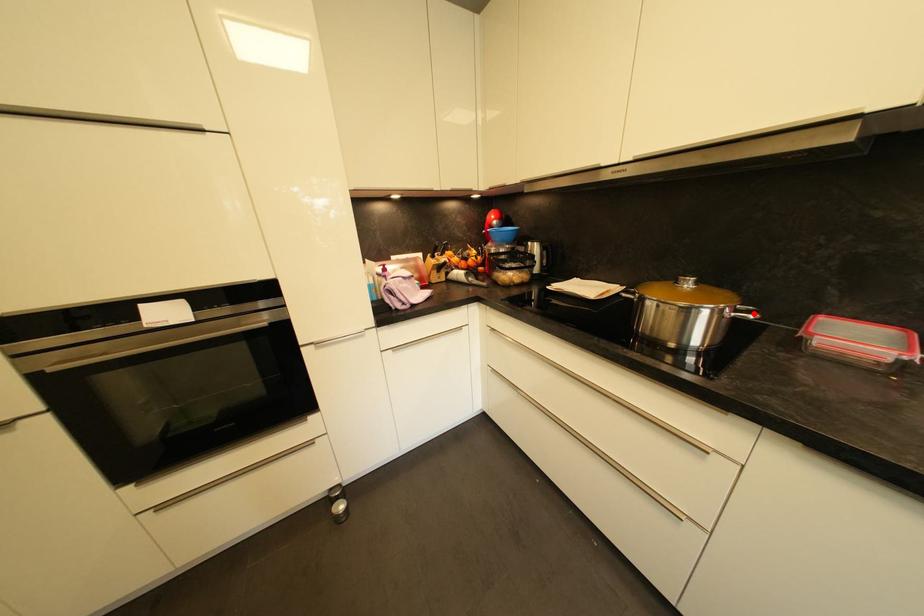
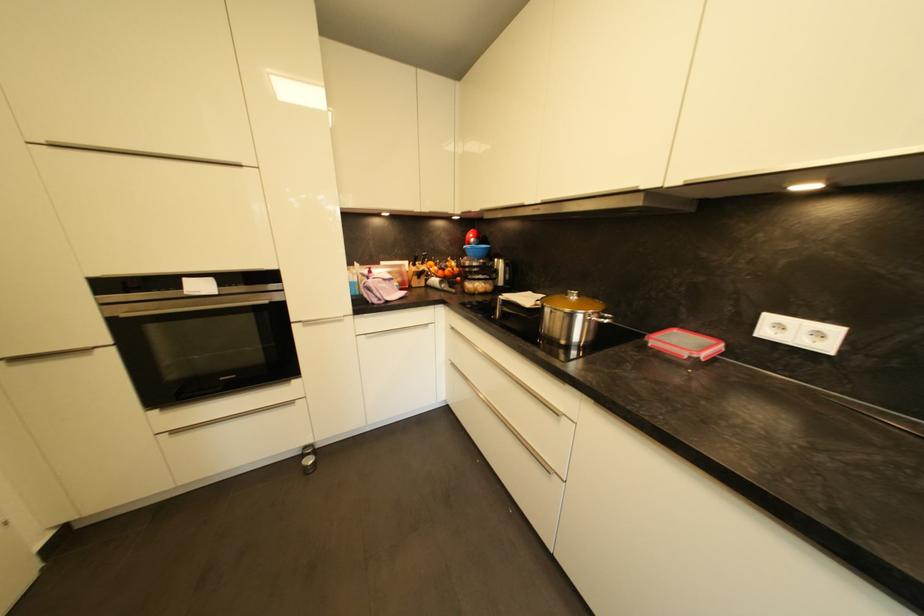
In the second image, find the point that corresponds to the highlighted location in the first image.

(610, 320)